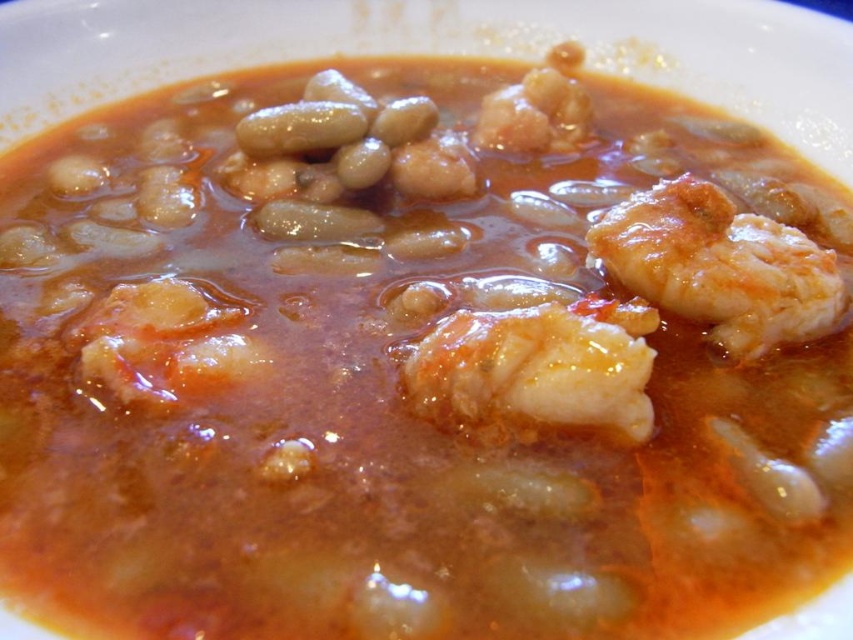
Which is more to the right, translucent gelatinous shrimp at center or white glossy shrimp at right?

From the viewer's perspective, white glossy shrimp at right appears more on the right side.

Which is in front, point (564, 307) or point (831, 296)?

Point (564, 307) is in front.

You are a GUI agent. You are given a task and a screenshot of the screen. Output one action in this format:
    pyautogui.click(x=<x>, y=<y>)
    Task: Click on the translucent gelatinous shrimp at center
    This screenshot has height=640, width=853.
    Given the screenshot: What is the action you would take?
    pyautogui.click(x=537, y=371)